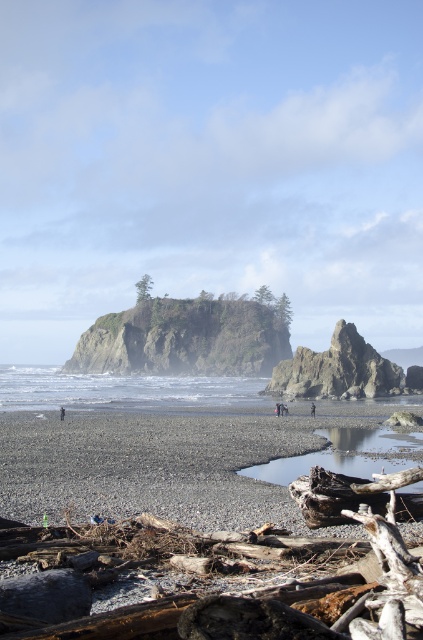
Question: Which object is positioned closest to the dark blue jeans at center?

Choices:
 (A) dark gray fabric at lower left
 (B) smooth pebbles at lower left

Answer: (B)

Question: Is rough rock cliff at center bigger than dark gray fabric at lower left?

Choices:
 (A) yes
 (B) no

Answer: (A)

Question: Can you confirm if smooth pebbles at lower left is positioned below rough textured rock formation at center?

Choices:
 (A) no
 (B) yes

Answer: (B)

Question: Which point is closer to the camera taking this photo?

Choices:
 (A) (60, 413)
 (B) (206, 337)
 (C) (342, 388)
 (D) (228, 474)

Answer: (D)

Question: Can you confirm if rough rock cliff at center is positioned above dark blue jeans at center?

Choices:
 (A) yes
 (B) no

Answer: (A)

Question: Which of the following is the closest to the observer?

Choices:
 (A) pyautogui.click(x=310, y=404)
 (B) pyautogui.click(x=235, y=317)

Answer: (A)